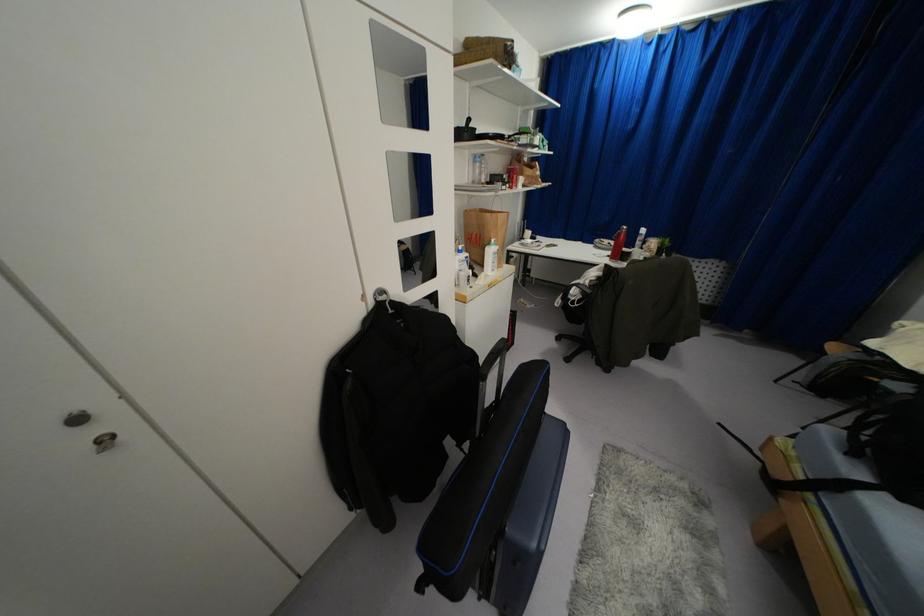
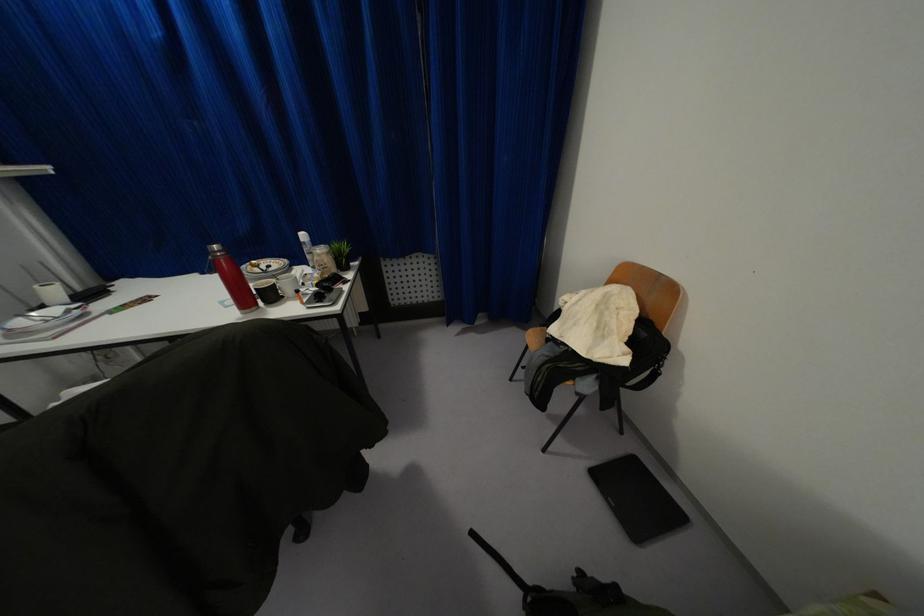
In the second image, find the point that corresponds to point 528,233 in the first image.

(53, 291)